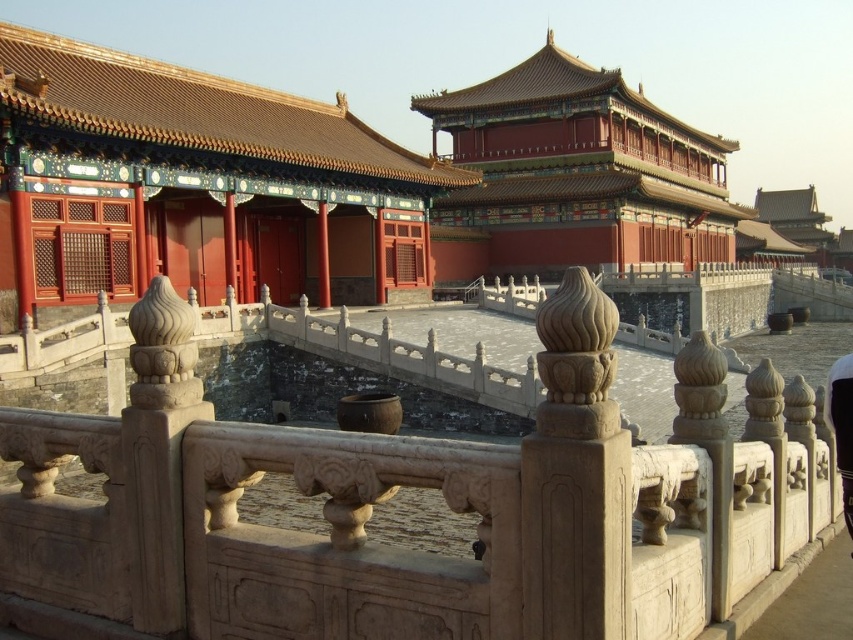
Does stone bridge at center appear on the right side of red lacquered wood palace at upper center?

No, stone bridge at center is not to the right of red lacquered wood palace at upper center.

Who is more forward, [537,461] or [599,172]?

Point [537,461]

Where is `stone bridge at center`? This screenshot has width=853, height=640. stone bridge at center is located at coordinates (408, 486).

Is stone bridge at center above matte red wood palace at center?

No, stone bridge at center is not above matte red wood palace at center.

Is the position of stone bridge at center less distant than that of matte red wood palace at center?

→ Yes, it is.

Who is more forward, (703,611) or (96,196)?

Point (703,611)

Where is `stone bridge at center`? Image resolution: width=853 pixels, height=640 pixels. stone bridge at center is located at coordinates (408, 486).

This screenshot has height=640, width=853. Identify the location of matte red wood palace at center. (x=198, y=182).

Measure the distance between matte red wood palace at center and camera.

matte red wood palace at center is 32.76 meters away from camera.

Identify the location of matte red wood palace at center. (198, 182).